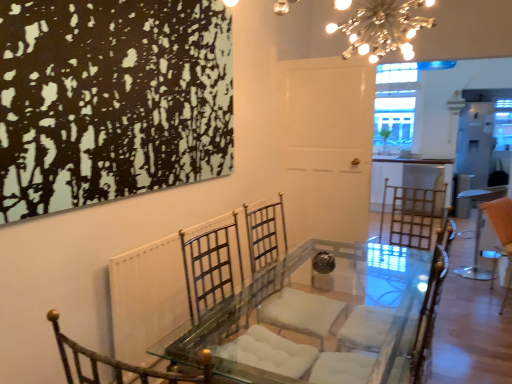
Question: In the image, is metallic gold armchair at center on the left side or the right side of clear glass window at upper center?

Choices:
 (A) left
 (B) right

Answer: (A)

Question: Does point (394, 253) appear closer or farther from the camera than point (385, 130)?

Choices:
 (A) closer
 (B) farther

Answer: (A)

Question: Based on their relative distances, which object is farther from the metallic gold armchair at center?

Choices:
 (A) metallic radiator at center
 (B) clear glass window at upper center
 (C) orange fabric swivel chair at right
 (D) orange fabric stool at right
 (E) metallic chandelier at upper center

Answer: (B)

Question: Which object is the closest to the clear glass window at upper center?

Choices:
 (A) orange fabric swivel chair at right
 (B) metallic gold armchair at center
 (C) metallic chandelier at upper center
 (D) metallic radiator at center
 (E) orange fabric stool at right

Answer: (E)